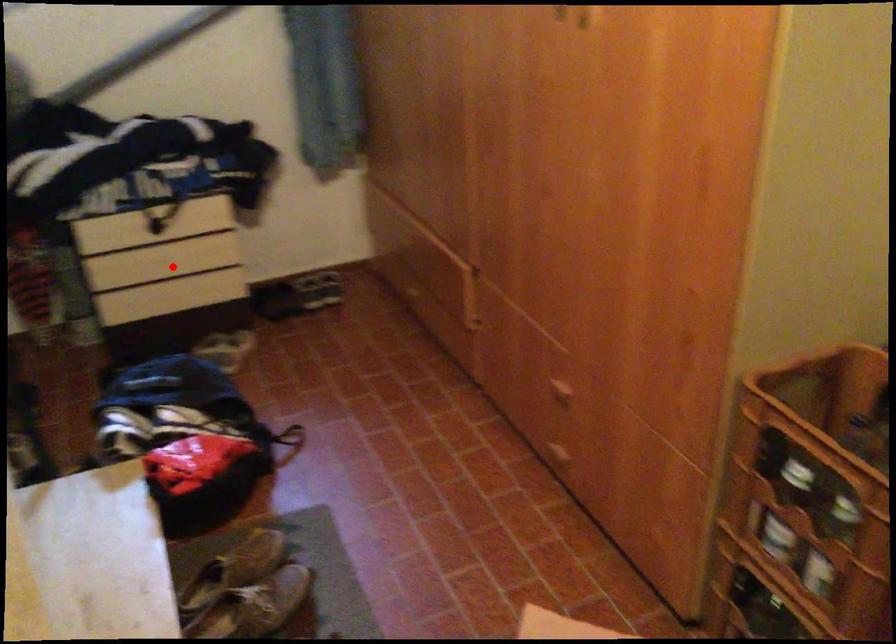
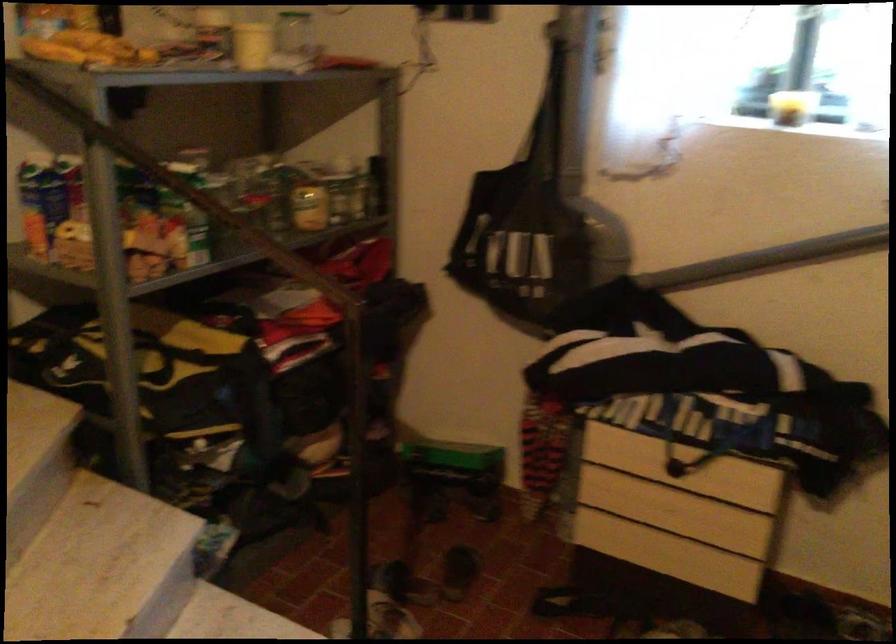
The point at the highlighted location is marked in the first image. Where is the corresponding point in the second image?

(668, 518)